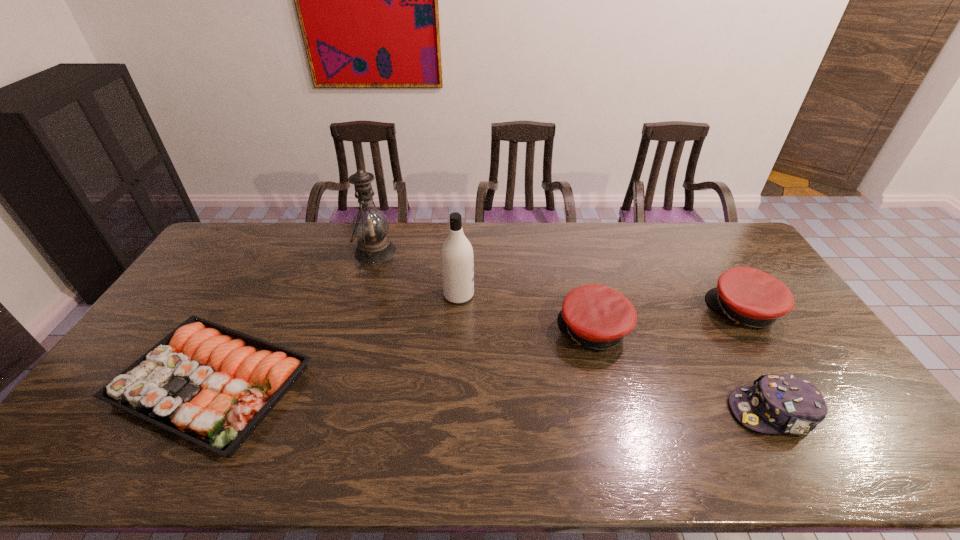
This screenshot has width=960, height=540. I want to click on object that is the fifth nearest to the platter, so click(x=747, y=296).

Find the location of a particular element. This screenshot has width=960, height=540. object identified as the fifth closest to the shortest object is located at coordinates (x=747, y=296).

Identify the location of the second closest headwear to the farthest object. (747, 296).

Point out which headwear is positioned as the third nearest to the platter. Please provide its 2D coordinates. Your answer should be formatted as a tuple, i.e. [(x, y)], where the tuple contains the x and y coordinates of a point satisfying the conditions above.

[(747, 296)]

Identify the location of free space in the image that satisfies the following two spatial constraints: 1. on the front-facing side of the shampoo; 2. on the front side of the platter. (454, 384).

Where is `blank space that satisfies the following two spatial constraints: 1. on the back side of the shortest object; 2. on the right side of the oil lamp`? blank space that satisfies the following two spatial constraints: 1. on the back side of the shortest object; 2. on the right side of the oil lamp is located at coordinates (284, 252).